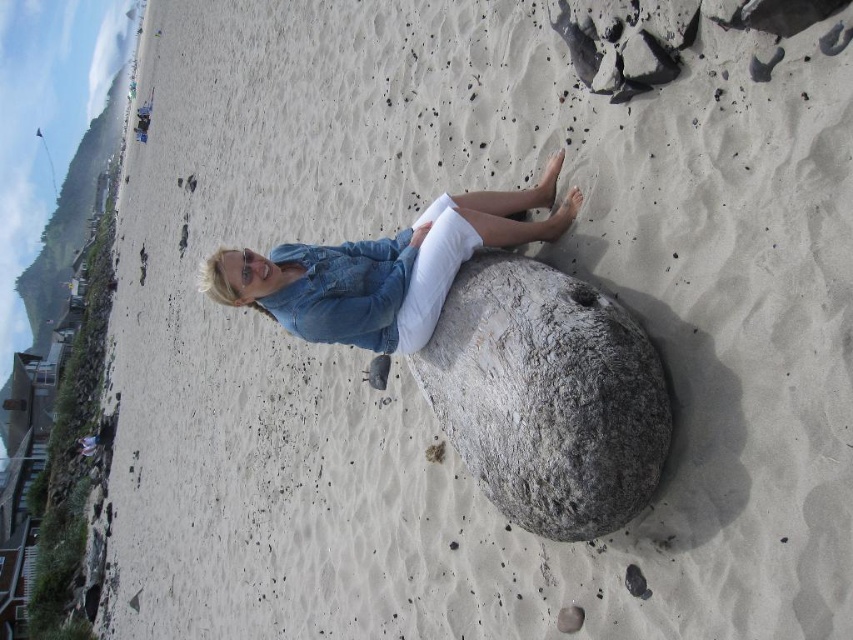
You are a photographer trying to capture the denim jacket at center and the gray rough boulder at center in the same frame. Based on their positions, which object is positioned lower in the image?

The gray rough boulder at center is located below the denim jacket at center, so it is positioned lower in the image.

You are standing at the point marked as point [547,396]. What object is located exactly at your current position?

The gray rough boulder at center is located exactly at point [547,396].